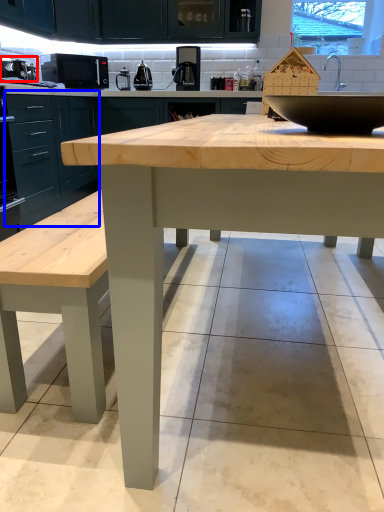
Question: Which object is closer to the camera taking this photo, appliance (highlighted by a red box) or cabinetry (highlighted by a blue box)?

Choices:
 (A) appliance
 (B) cabinetry

Answer: (B)